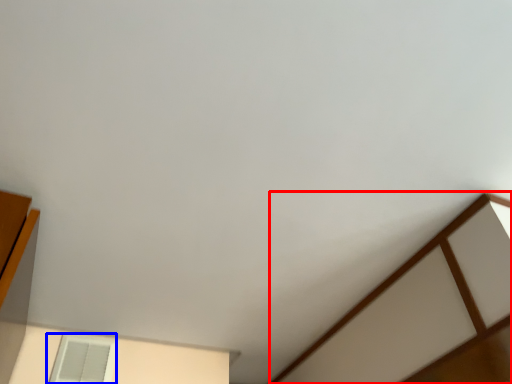
Question: Which of the following is the closest to the observer, furniture (highlighted by a red box) or window (highlighted by a blue box)?

Choices:
 (A) furniture
 (B) window

Answer: (A)